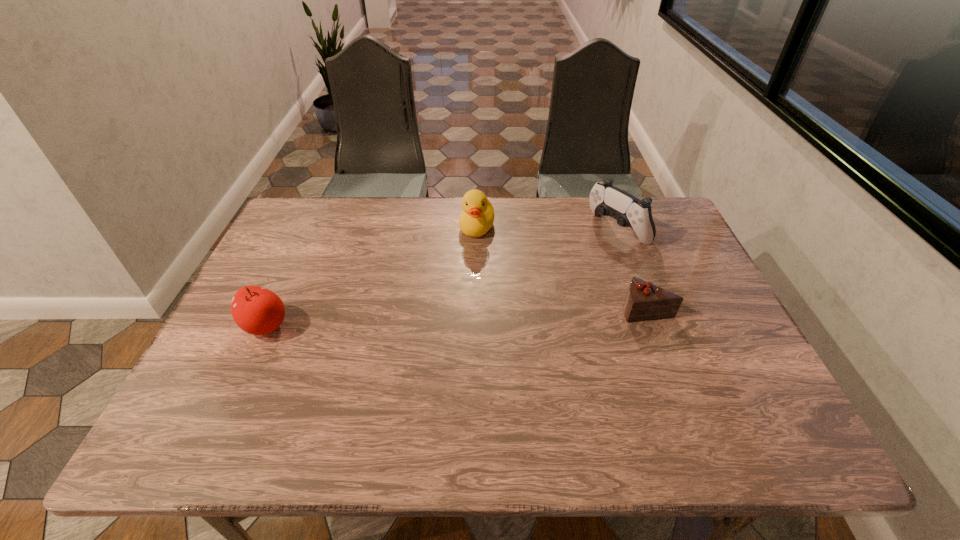
You are a GUI agent. You are given a task and a screenshot of the screen. Output one action in this format:
    pyautogui.click(x=<x>, y=<y>)
    Task: Click on the free space at the left edge of the desktop
    This screenshot has width=960, height=540.
    Given the screenshot: What is the action you would take?
    pyautogui.click(x=309, y=251)

Locate an element on the screen. free space at the right edge is located at coordinates (722, 330).

The width and height of the screenshot is (960, 540). In the image, there is a desktop. What are the coordinates of `vacant region at the far right corner` in the screenshot? It's located at (660, 231).

Locate an element on the screen. free space between the leftmost object and the second object from left to right is located at coordinates (372, 277).

The image size is (960, 540). In order to click on empty location between the leftmost object and the chocolate cake in this screenshot , I will do `click(456, 318)`.

Identify the location of empty space that is in between the control and the shortest object. (632, 269).

Image resolution: width=960 pixels, height=540 pixels. What are the coordinates of `vacant area that lies between the leftmost object and the control` in the screenshot? It's located at (442, 278).

Locate an element on the screen. This screenshot has height=540, width=960. vacant area that lies between the chocolate cake and the duck is located at coordinates (562, 268).

I want to click on free space between the leftmost object and the control, so click(x=442, y=278).

You are a GUI agent. You are given a task and a screenshot of the screen. Output one action in this format:
    pyautogui.click(x=<x>, y=<y>)
    Task: Click on the free spot between the control and the second object from left to right
    This screenshot has height=540, width=960.
    Given the screenshot: What is the action you would take?
    pyautogui.click(x=547, y=229)